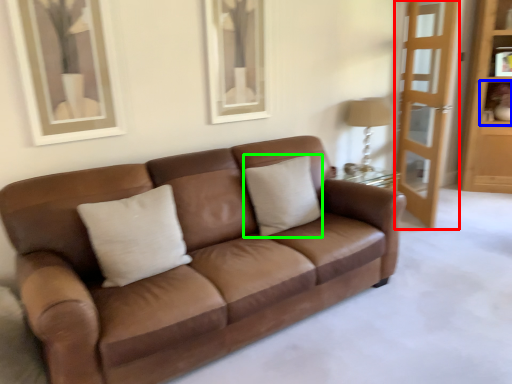
Question: Which object is positioned farthest from screen door (highlighted by a red box)? Select from shelf (highlighted by a blue box) and pillow (highlighted by a green box).

Choices:
 (A) shelf
 (B) pillow

Answer: (B)